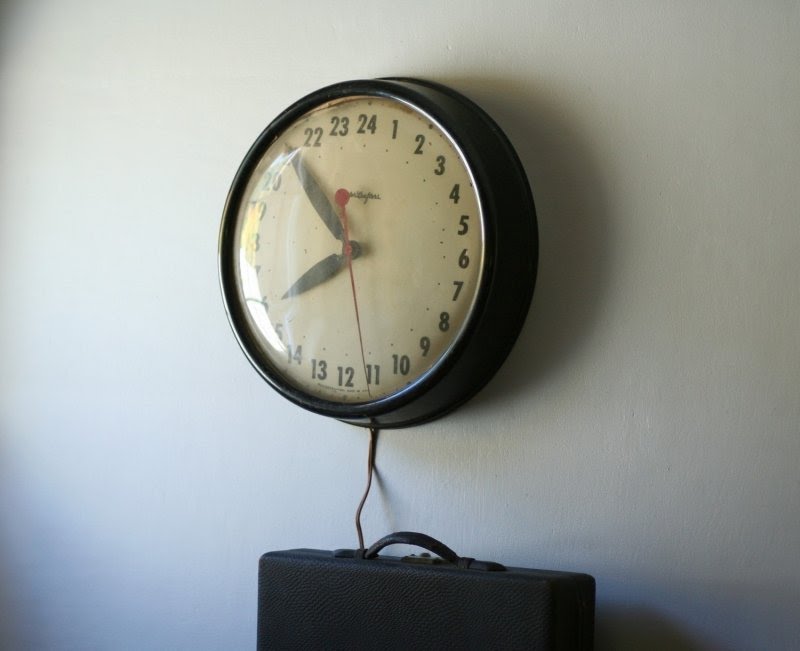
You are a GUI agent. You are given a task and a screenshot of the screen. Output one action in this format:
    pyautogui.click(x=<x>, y=<y>)
    Task: Click on the handle
    The image size is (800, 651).
    Given the screenshot: What is the action you would take?
    pyautogui.click(x=373, y=540)